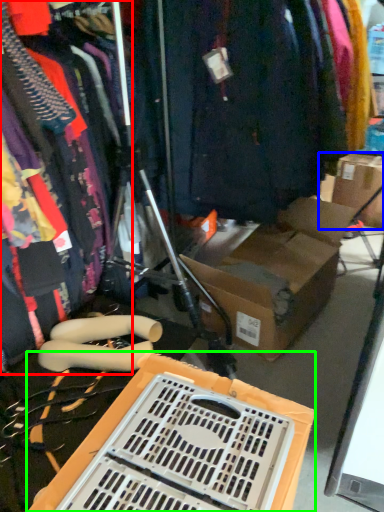
Question: Which object is positioned closest to clothing (highlighted by a red box)? Select from cardboard box (highlighted by a blue box) and storage box (highlighted by a green box).

Choices:
 (A) cardboard box
 (B) storage box

Answer: (B)